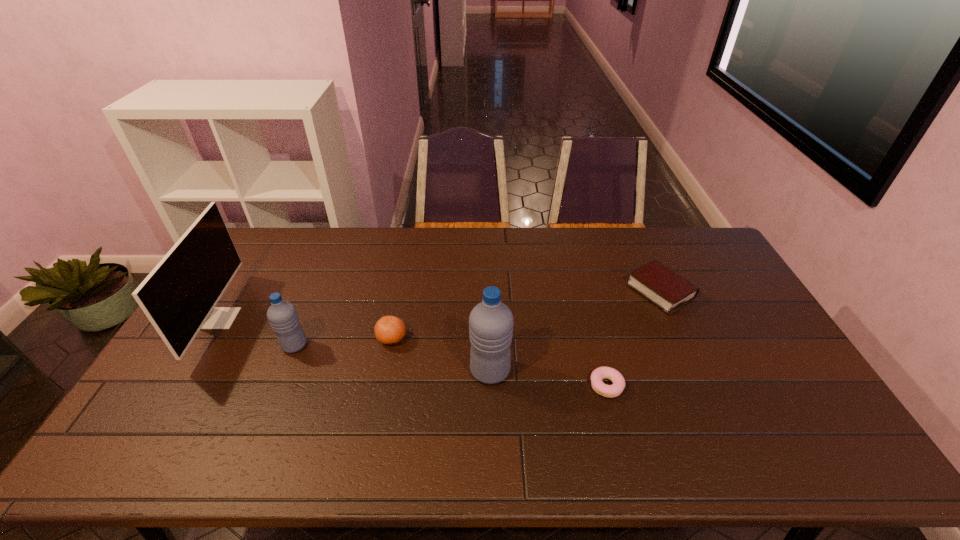
What are the coordinates of `the shorter water bottle` in the screenshot? It's located at (282, 315).

Locate an element on the screen. The width and height of the screenshot is (960, 540). the left water bottle is located at coordinates (282, 315).

Identify the location of the taller water bottle. This screenshot has width=960, height=540. (491, 322).

Locate an element on the screen. This screenshot has height=540, width=960. the right water bottle is located at coordinates (491, 322).

Where is `the third object from left to right`? the third object from left to right is located at coordinates (388, 330).

Identify the location of clementine. (388, 330).

Identify the location of Bible. (663, 287).

Find the location of a particular element. Image resolution: width=960 pixels, height=540 pixels. the rightmost object is located at coordinates (663, 287).

In order to click on doughnut in this screenshot , I will do `click(610, 391)`.

Identify the location of the shortest object. (610, 391).